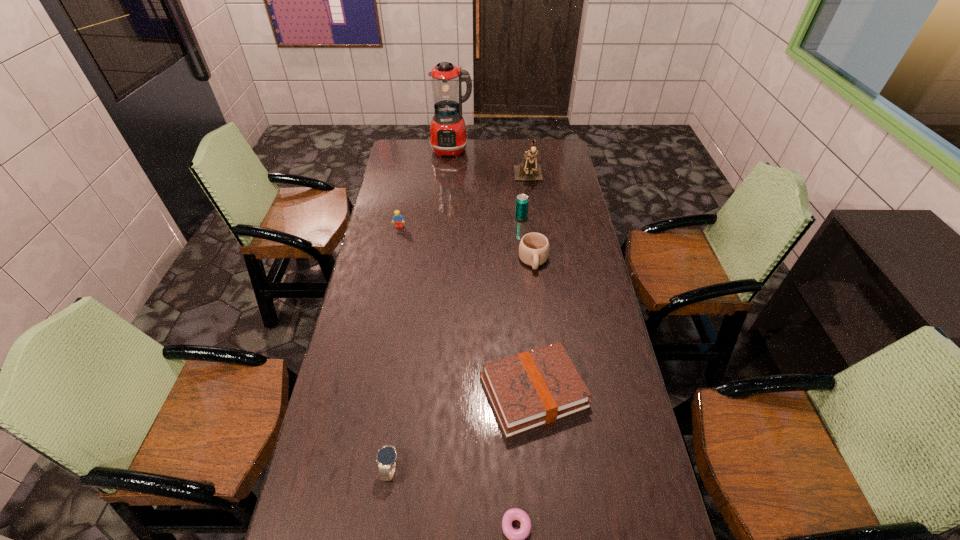
Where is `food processor`? The width and height of the screenshot is (960, 540). food processor is located at coordinates (448, 137).

Where is `the farthest object`? the farthest object is located at coordinates (448, 137).

This screenshot has width=960, height=540. I want to click on figurine, so click(x=528, y=170).

Identify the location of the seventh nearest object. This screenshot has height=540, width=960. (528, 170).

The width and height of the screenshot is (960, 540). I want to click on beer can, so click(521, 205).

You are a GUI agent. You are given a task and a screenshot of the screen. Output one action in this format:
    pyautogui.click(x=<x>, y=<y>)
    Task: Click on the sixth shortest object
    
    Given the screenshot: What is the action you would take?
    pyautogui.click(x=521, y=205)

You are a GUI agent. You are given a task and a screenshot of the screen. Output one action in this format:
    pyautogui.click(x=<x>, y=<y>)
    Task: Click on the mug
    
    Given the screenshot: What is the action you would take?
    pyautogui.click(x=534, y=247)

At what (x,y) coordinates should I click in order to perform the action: click on Lego. Please return your answer as a coordinate pair (x, y). Looking at the image, I should click on (398, 218).

Locate an element on the screen. The height and width of the screenshot is (540, 960). the leftmost object is located at coordinates (398, 218).

I want to click on watch, so click(x=387, y=456).